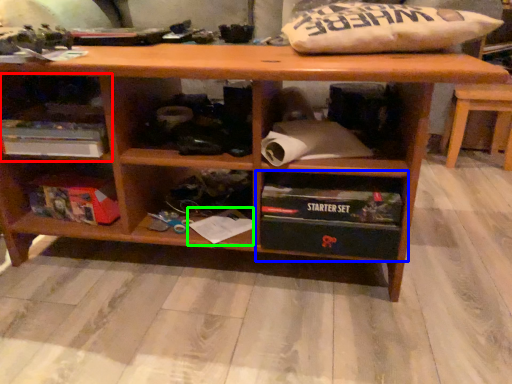
Question: Which object is the closest to the shelf (highlighted by a red box)? Choose among these: shelf (highlighted by a blue box) or book (highlighted by a green box).

Choices:
 (A) shelf
 (B) book

Answer: (B)